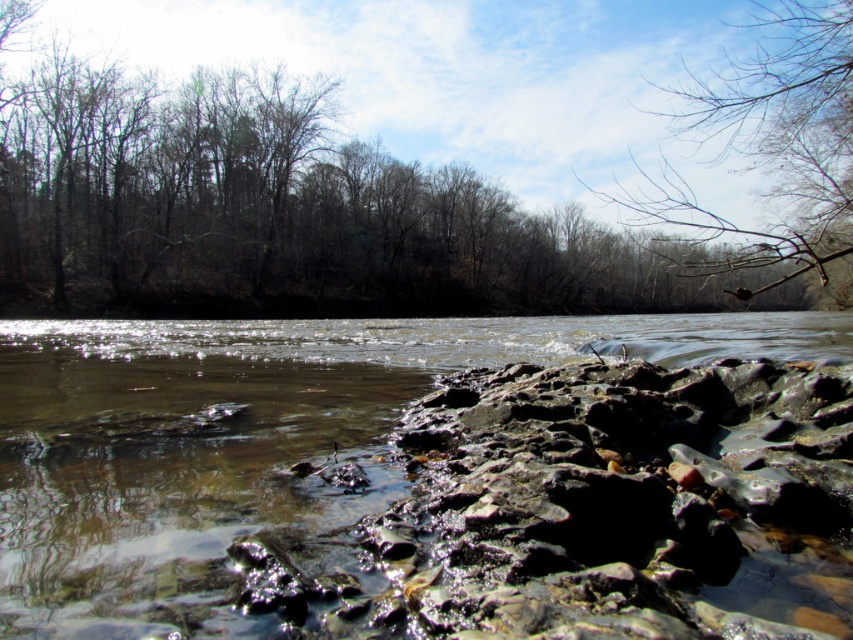
Does clear water at center come in front of bare branches at upper right?

Yes, it is.

Measure the distance between point (575, 576) and camera.

Point (575, 576) is 3.97 meters from camera.

Does point (807, 333) come behind point (850, 291)?

No, (807, 333) is closer to viewer.

You are a GUI agent. You are given a task and a screenshot of the screen. Output one action in this format:
    pyautogui.click(x=<x>, y=<y>)
    Task: Click on the clear water at center
    
    Given the screenshot: What is the action you would take?
    pyautogui.click(x=427, y=477)

Who is taller, brown leafless trees at upper center or bare branches at upper right?

bare branches at upper right is taller.

From the picture: Who is shorter, brown leafless trees at upper center or bare branches at upper right?

brown leafless trees at upper center

Between point (311, 173) and point (723, 108), which one is positioned behind?

Positioned behind is point (311, 173).

The width and height of the screenshot is (853, 640). I want to click on brown leafless trees at upper center, so click(x=276, y=212).

Is clear water at center below brown leafless trees at upper center?

Correct, clear water at center is located below brown leafless trees at upper center.

Is clear water at center further to camera compared to brown leafless trees at upper center?

No, clear water at center is closer to the viewer.

Is point (732, 616) closer to viewer compared to point (296, 221)?

Yes, point (732, 616) is in front of point (296, 221).

What are the coordinates of `clear water at center` in the screenshot? It's located at (427, 477).